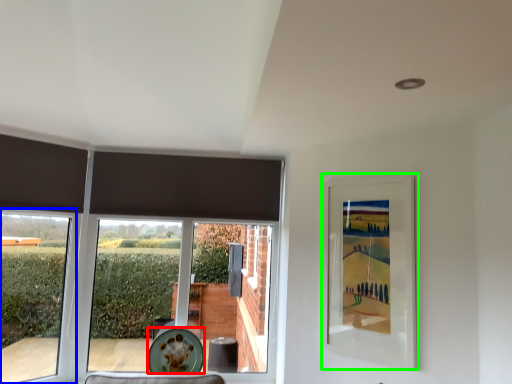
Question: Which object is positioned closest to plate (highlighted by a red box)? Select from window (highlighted by a blue box) and picture frame (highlighted by a green box).

Choices:
 (A) window
 (B) picture frame

Answer: (A)